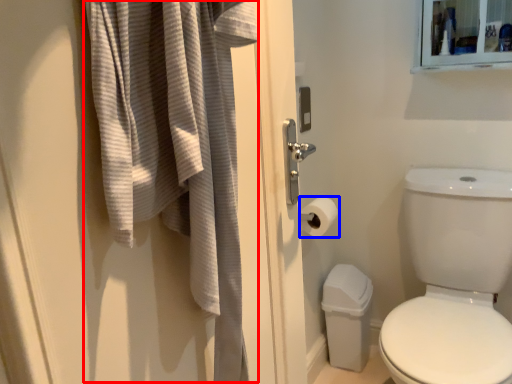
Question: Which object is further to the camera taking this photo, bath towel (highlighted by a red box) or toilet paper (highlighted by a blue box)?

Choices:
 (A) bath towel
 (B) toilet paper

Answer: (B)